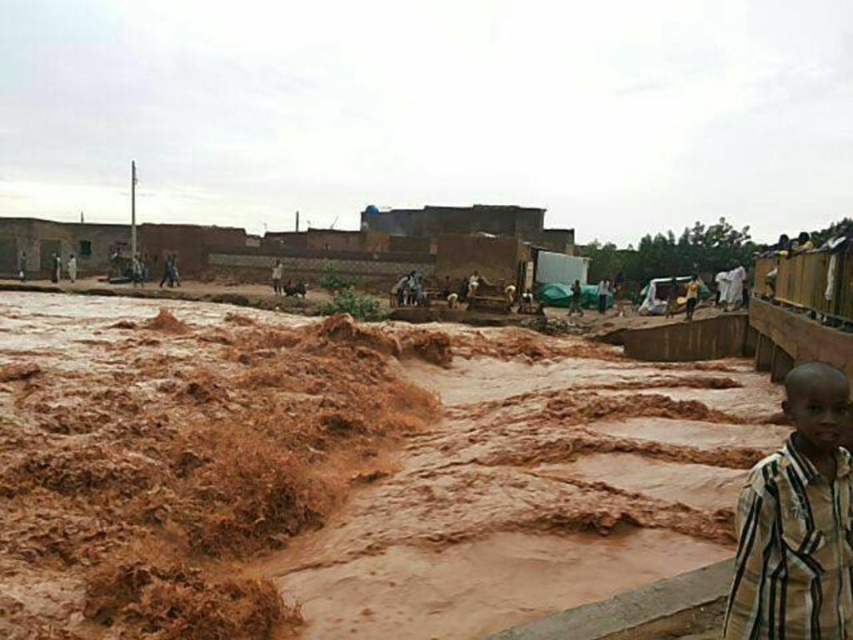
Question: Is brown muddy water at lower left below striped fabric boy at lower right?

Choices:
 (A) no
 (B) yes

Answer: (A)

Question: Which object is farther from the camera taking this photo?

Choices:
 (A) brown muddy water at lower left
 (B) striped fabric boy at lower right

Answer: (A)

Question: Is brown muddy water at lower left to the right of striped fabric boy at lower right from the viewer's perspective?

Choices:
 (A) yes
 (B) no

Answer: (B)

Question: Is brown muddy water at lower left to the right of striped fabric boy at lower right from the viewer's perspective?

Choices:
 (A) no
 (B) yes

Answer: (A)

Question: Which point is closer to the camera?

Choices:
 (A) brown muddy water at lower left
 (B) striped fabric boy at lower right

Answer: (B)